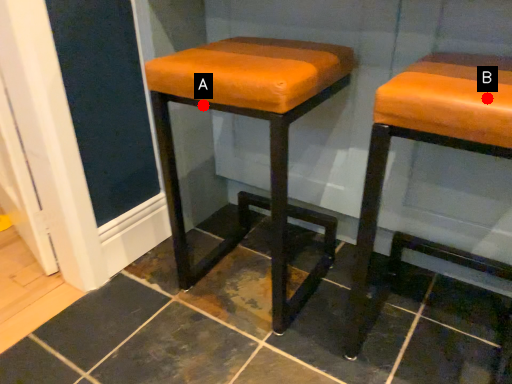
Question: Two points are circled on the image, labeled by A and B beside each circle. Which point is closer to the camera taking this photo?

Choices:
 (A) A is closer
 (B) B is closer

Answer: (B)